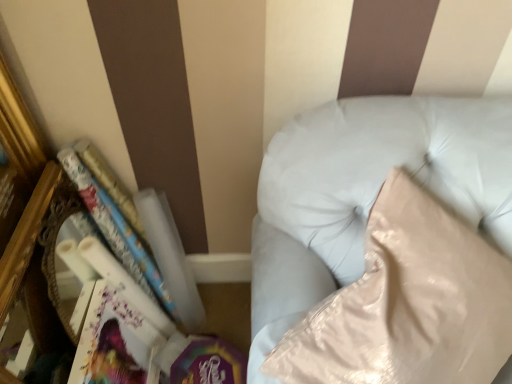
Question: Is matte white paperback book at lower left inside or outside of white leather couch at upper right?

Choices:
 (A) outside
 (B) inside

Answer: (A)

Question: Is matte white paperback book at lower left in front of or behind white leather couch at upper right in the image?

Choices:
 (A) behind
 (B) front

Answer: (A)

Question: Estimate the real-world distances between objects in this image. Which object is farther from the white glossy book at left?

Choices:
 (A) white leather couch at upper right
 (B) matte white paperback book at lower left

Answer: (A)

Question: Which object is the closest to the white leather couch at upper right?

Choices:
 (A) white glossy book at left
 (B) matte white paperback book at lower left

Answer: (A)